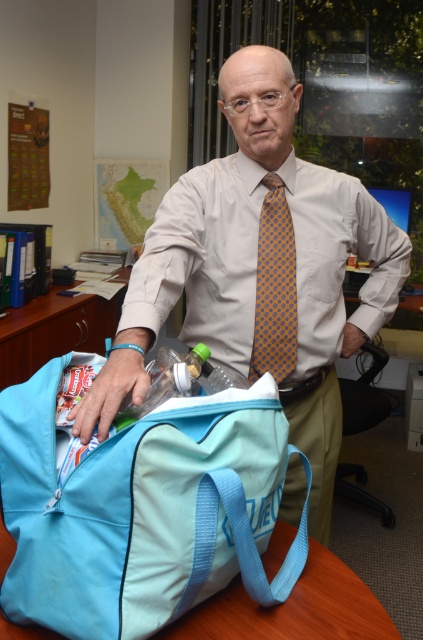
Question: Which of these objects is positioned closest to the blue fabric bag at lower left?

Choices:
 (A) yellow dotted tie at center
 (B) beige cotton dress shirt at center
 (C) light blue fabric bag at center
 (D) light blue fabric bag at lower center

Answer: (B)

Question: Among these objects, which one is farthest from the camera?

Choices:
 (A) blue fabric bag at lower left
 (B) light blue fabric bag at center

Answer: (A)

Question: Is light blue fabric bag at center to the right of beige cotton dress shirt at center from the viewer's perspective?

Choices:
 (A) yes
 (B) no

Answer: (B)

Question: Is matte blue duffel bag at center further to the viewer compared to light blue fabric bag at center?

Choices:
 (A) no
 (B) yes

Answer: (B)

Question: Which object appears closest to the camera in this image?

Choices:
 (A) light blue fabric bag at center
 (B) yellow dotted tie at center

Answer: (A)

Question: Can you confirm if matte blue duffel bag at center is positioned to the left of light blue fabric bag at lower center?

Choices:
 (A) yes
 (B) no

Answer: (B)